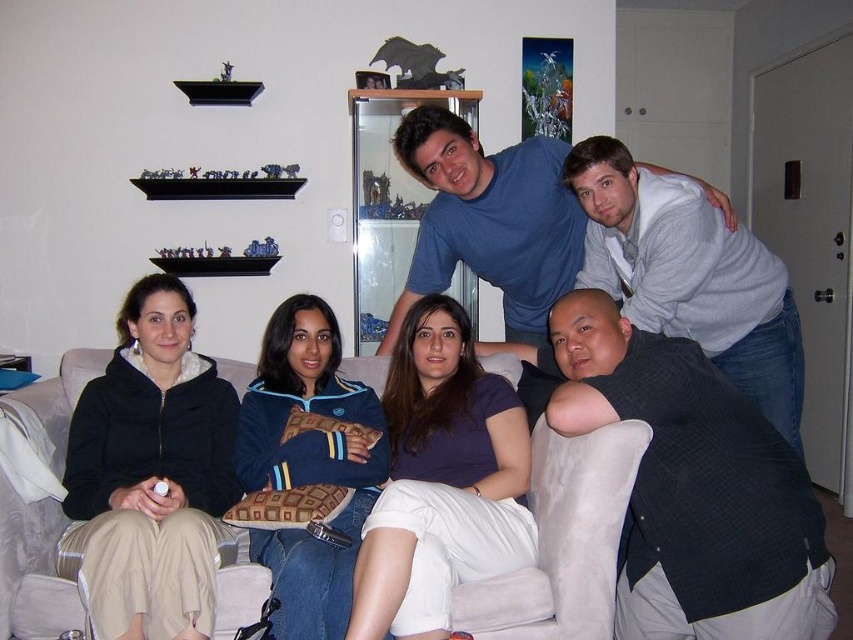
Question: Which is farther from the blue cotton shirt at upper center?

Choices:
 (A) beige fabric couch at center
 (B) black textured vest at lower right
 (C) matte black jacket at lower left

Answer: (B)

Question: Which point is closer to the camera taking this photo?

Choices:
 (A) (693, 230)
 (B) (776, 356)

Answer: (A)

Question: Which object appears farthest from the camera in this image?

Choices:
 (A) beige fabric couch at center
 (B) black textured vest at lower right

Answer: (A)

Question: Does matte black jacket at lower left have a lesser width compared to beige fabric couch at center?

Choices:
 (A) no
 (B) yes

Answer: (A)

Question: Does gray sweater at upper right have a greater width compared to blue cotton shirt at upper center?

Choices:
 (A) yes
 (B) no

Answer: (A)

Question: Does gray sweater at upper right have a larger size compared to blue cotton shirt at upper center?

Choices:
 (A) yes
 (B) no

Answer: (B)